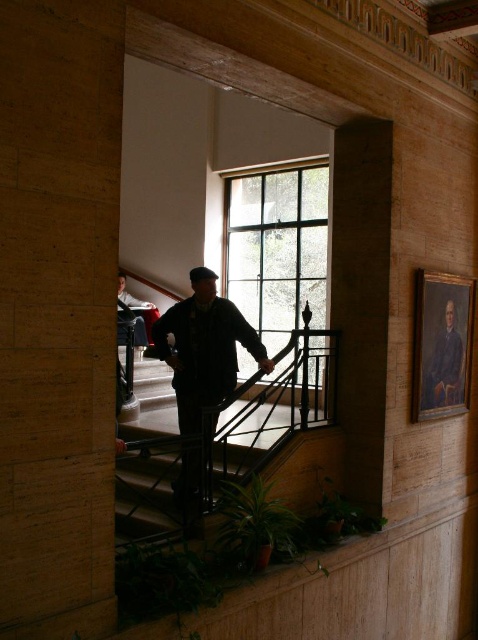
Question: Which point is farther to the camera?

Choices:
 (A) dark blue canvas portrait at right
 (B) dark blue jeans at lower left
 (C) oil painting at upper right

Answer: (B)

Question: Which object appears farthest from the camera in this image?

Choices:
 (A) dark blue jeans at lower left
 (B) oil painting at upper right
 (C) dark blue canvas portrait at right
 (D) dark green fabric jacket at center

Answer: (A)

Question: Can you confirm if oil painting at upper right is positioned below dark blue canvas portrait at right?

Choices:
 (A) yes
 (B) no

Answer: (B)

Question: Can you confirm if dark green fabric jacket at center is positioned to the left of dark blue canvas portrait at right?

Choices:
 (A) yes
 (B) no

Answer: (A)

Question: Is dark blue canvas portrait at right below dark blue jeans at lower left?

Choices:
 (A) no
 (B) yes

Answer: (B)

Question: Which of the following is the closest to the observer?

Choices:
 (A) oil painting at upper right
 (B) dark blue jeans at lower left
 (C) dark green fabric jacket at center

Answer: (C)